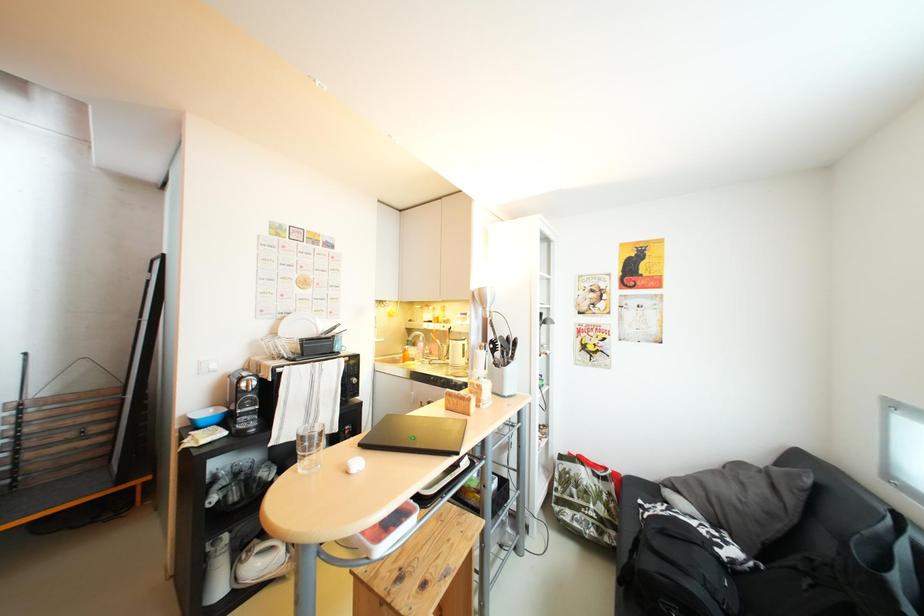
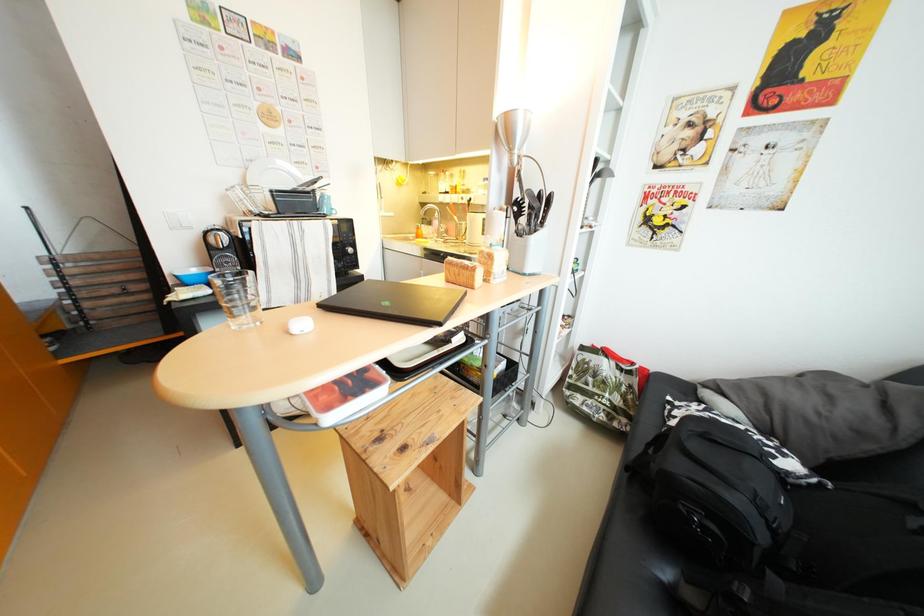
Question: The first image is from the beginning of the video and the second image is from the end. How did the camera likely rotate when shooting the video?

Choices:
 (A) Left
 (B) Right
 (C) Up
 (D) Down

Answer: (D)